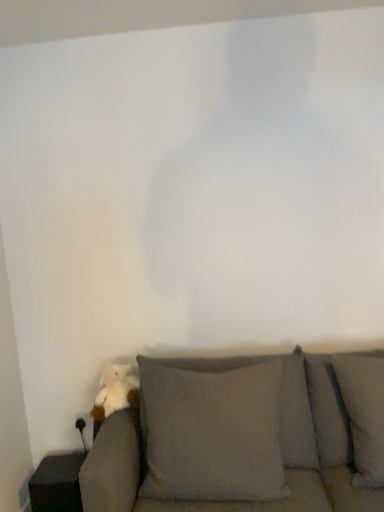
Question: From a real-world perspective, is gray fabric couch at lower left positioned above or below white plush toy at lower left?

Choices:
 (A) above
 (B) below

Answer: (B)

Question: Is gray fabric couch at lower left situated inside white plush toy at lower left or outside?

Choices:
 (A) inside
 (B) outside

Answer: (B)

Question: From their relative heights in the image, would you say gray fabric couch at lower left is taller or shorter than white plush toy at lower left?

Choices:
 (A) tall
 (B) short

Answer: (A)

Question: Is white plush toy at lower left wider or thinner than gray fabric couch at lower left?

Choices:
 (A) thin
 (B) wide

Answer: (A)

Question: From the image's perspective, is white plush toy at lower left positioned above or below gray fabric couch at lower left?

Choices:
 (A) above
 (B) below

Answer: (A)

Question: Is white plush toy at lower left inside or outside of gray fabric couch at lower left?

Choices:
 (A) outside
 (B) inside

Answer: (B)

Question: From a real-world perspective, is white plush toy at lower left positioned above or below gray fabric couch at lower left?

Choices:
 (A) above
 (B) below

Answer: (A)